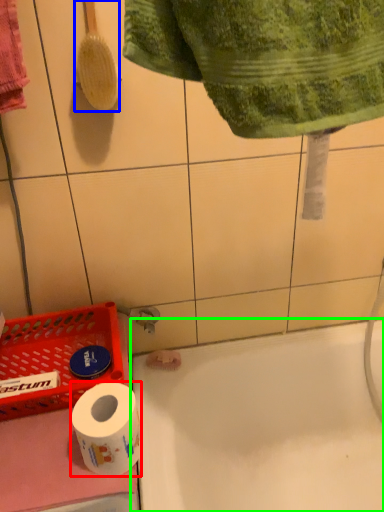
Question: Based on their relative distances, which object is farther from toilet paper (highlighted by a red box)? Choose from brush (highlighted by a blue box) and bath (highlighted by a green box).

Choices:
 (A) brush
 (B) bath

Answer: (A)